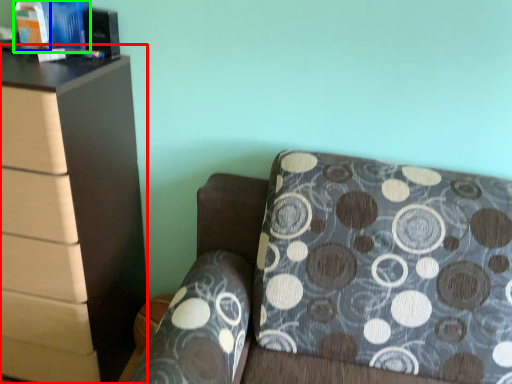
Question: Which is nearer to the chest of drawers (highlighted by a red box)? book (highlighted by a blue box) or book (highlighted by a green box).

Choices:
 (A) book
 (B) book

Answer: (B)